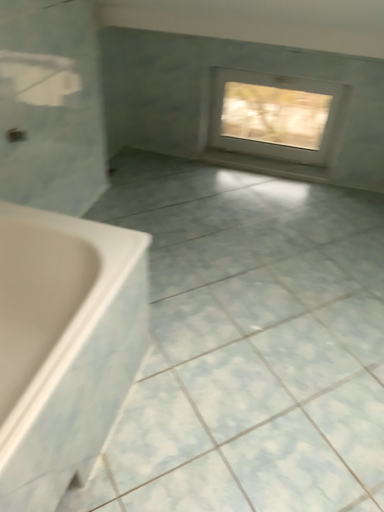
Question: Considering the relative sizes of white frosted glass window at upper center and white plastic bathtub at lower left in the image provided, is white frosted glass window at upper center taller than white plastic bathtub at lower left?

Choices:
 (A) yes
 (B) no

Answer: (A)

Question: Does white frosted glass window at upper center have a greater width compared to white plastic bathtub at lower left?

Choices:
 (A) no
 (B) yes

Answer: (A)

Question: Can you confirm if white frosted glass window at upper center is positioned to the right of white plastic bathtub at lower left?

Choices:
 (A) no
 (B) yes

Answer: (B)

Question: Is white frosted glass window at upper center thinner than white plastic bathtub at lower left?

Choices:
 (A) yes
 (B) no

Answer: (A)

Question: Does white frosted glass window at upper center have a larger size compared to white plastic bathtub at lower left?

Choices:
 (A) yes
 (B) no

Answer: (B)

Question: Looking at their shapes, would you say white frosted glass window at upper center is wider or thinner than white plastic bathtub at lower left?

Choices:
 (A) wide
 (B) thin

Answer: (B)

Question: From their relative heights in the image, would you say white frosted glass window at upper center is taller or shorter than white plastic bathtub at lower left?

Choices:
 (A) tall
 (B) short

Answer: (A)

Question: From the image's perspective, relative to white plastic bathtub at lower left, is white frosted glass window at upper center above or below?

Choices:
 (A) below
 (B) above

Answer: (B)

Question: Would you say white frosted glass window at upper center is inside or outside white plastic bathtub at lower left?

Choices:
 (A) inside
 (B) outside

Answer: (B)

Question: Is white glossy ceramic tile at center bigger or smaller than white plastic bathtub at lower left?

Choices:
 (A) small
 (B) big

Answer: (A)

Question: In terms of width, does white glossy ceramic tile at center look wider or thinner when compared to white plastic bathtub at lower left?

Choices:
 (A) wide
 (B) thin

Answer: (A)

Question: From the image's perspective, is white glossy ceramic tile at center located above or below white plastic bathtub at lower left?

Choices:
 (A) above
 (B) below

Answer: (A)

Question: Considering the relative positions of white glossy ceramic tile at center and white plastic bathtub at lower left in the image provided, is white glossy ceramic tile at center to the left or to the right of white plastic bathtub at lower left?

Choices:
 (A) left
 (B) right

Answer: (B)

Question: In terms of width, does white glossy ceramic tile at center look wider or thinner when compared to white frosted glass window at upper center?

Choices:
 (A) wide
 (B) thin

Answer: (A)

Question: Considering the positions of white glossy ceramic tile at center and white frosted glass window at upper center in the image, is white glossy ceramic tile at center taller or shorter than white frosted glass window at upper center?

Choices:
 (A) short
 (B) tall

Answer: (A)